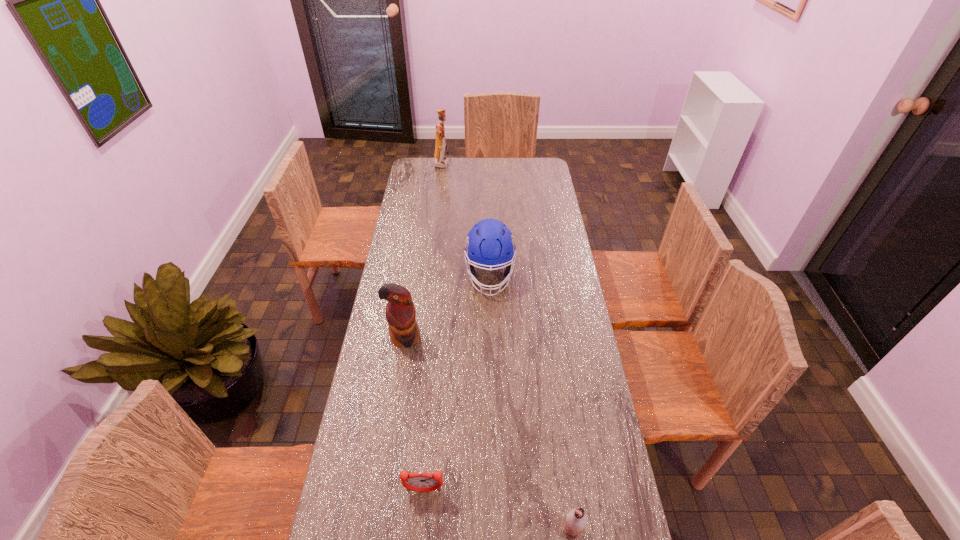
Identify the location of free area in between the shortest object and the nutcracker. The image size is (960, 540). (433, 327).

This screenshot has width=960, height=540. In order to click on vacant space that is in between the farthest object and the third nearest object in this screenshot , I will do `click(423, 251)`.

This screenshot has width=960, height=540. What are the coordinates of `free point between the second farthest object and the alarm clock` in the screenshot? It's located at (457, 383).

Where is `vacant space in between the farthest object and the third tallest object`? Image resolution: width=960 pixels, height=540 pixels. vacant space in between the farthest object and the third tallest object is located at coordinates (467, 220).

Where is `free spot between the football helmet and the alarm clock`? free spot between the football helmet and the alarm clock is located at coordinates (457, 383).

Identify which object is the fourth closest to the shortest object. Please provide its 2D coordinates. Your answer should be formatted as a tuple, i.e. [(x, y)], where the tuple contains the x and y coordinates of a point satisfying the conditions above.

[(440, 161)]

Identify which object is located as the second nearest to the nutcracker. Please provide its 2D coordinates. Your answer should be formatted as a tuple, i.e. [(x, y)], where the tuple contains the x and y coordinates of a point satisfying the conditions above.

[(400, 312)]

Identify the location of vacant space that satisfies the following two spatial constraints: 1. on the front-facing side of the nutcracker; 2. on the face of the parrot. The height and width of the screenshot is (540, 960). (421, 338).